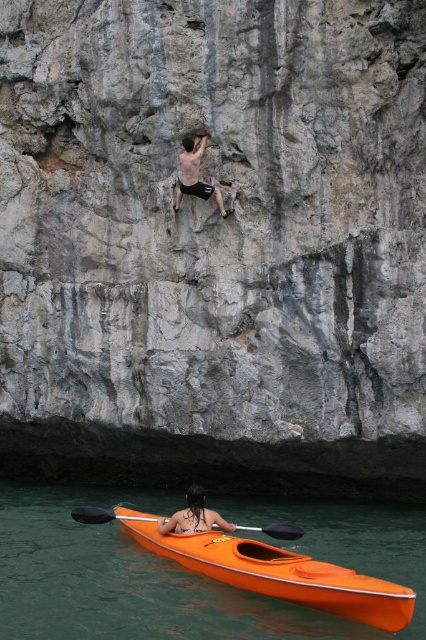
Question: Which point is closer to the camera?

Choices:
 (A) orange plastic paddle at lower center
 (B) dark brown hair at lower center
 (C) smooth skin rock climber at upper center

Answer: (A)

Question: Is dark brown hair at lower center wider than orange plastic paddle at lower center?

Choices:
 (A) no
 (B) yes

Answer: (A)

Question: Which object is farther from the camera taking this photo?

Choices:
 (A) orange plastic paddle at lower center
 (B) dark brown hair at lower center
 (C) smooth skin rock climber at upper center
 (D) orange plastic kayak at lower center

Answer: (C)

Question: Based on their relative distances, which object is farther from the dark brown hair at lower center?

Choices:
 (A) smooth skin rock climber at upper center
 (B) orange plastic paddle at lower center

Answer: (A)

Question: Does orange plastic kayak at lower center lie in front of smooth skin rock climber at upper center?

Choices:
 (A) yes
 (B) no

Answer: (A)

Question: Is smooth skin rock climber at upper center above orange plastic paddle at lower center?

Choices:
 (A) yes
 (B) no

Answer: (A)